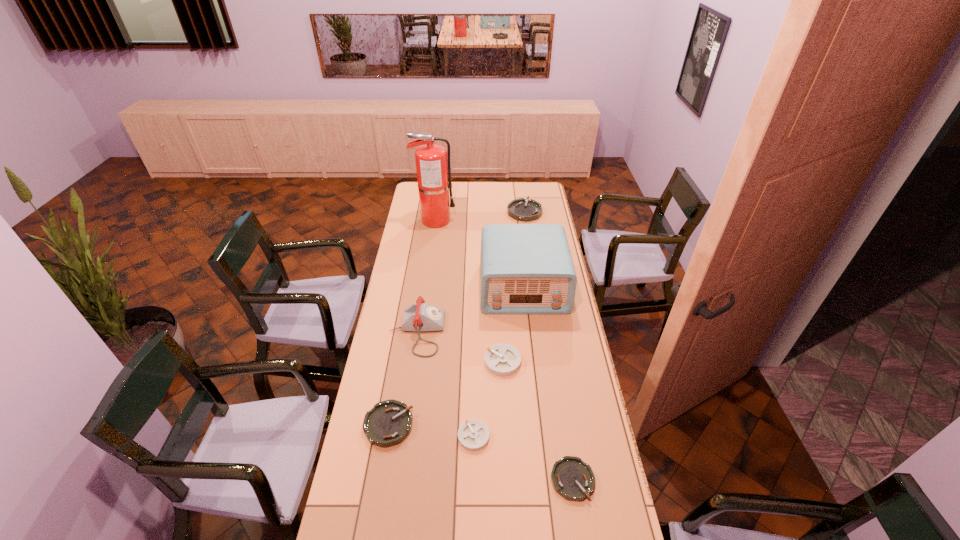
The height and width of the screenshot is (540, 960). I want to click on vacant space situated 0.220m on the right of the nearer gray ashtray, so click(554, 436).

Identify the location of vacant region located 0.170m on the left of the nearest object. Image resolution: width=960 pixels, height=540 pixels. (496, 480).

At what (x,y) coordinates should I click in order to perform the action: click on object that is at the far edge. Please return your answer as a coordinate pair (x, y). The image size is (960, 540). Looking at the image, I should click on (522, 209).

Locate an element on the screen. The image size is (960, 540). fire extinguisher that is at the left edge is located at coordinates (433, 172).

Where is `telephone present at the left edge`? The width and height of the screenshot is (960, 540). telephone present at the left edge is located at coordinates (419, 317).

Find the location of a particular element. ashtray at the left edge is located at coordinates (388, 423).

Locate an element on the screen. Image resolution: width=960 pixels, height=540 pixels. radio receiver situated at the right edge is located at coordinates (527, 269).

Find the location of a particular element. object that is at the far right corner is located at coordinates (522, 209).

You are a GUI agent. You are given a task and a screenshot of the screen. Output one action in this format:
    pyautogui.click(x=<x>, y=<y>)
    Task: Click on the free space at the far edge of the desktop
    The height and width of the screenshot is (540, 960).
    Given the screenshot: What is the action you would take?
    pyautogui.click(x=487, y=184)

Locate an element on the screen. The width and height of the screenshot is (960, 540). vacant space at the left edge of the desktop is located at coordinates (410, 205).